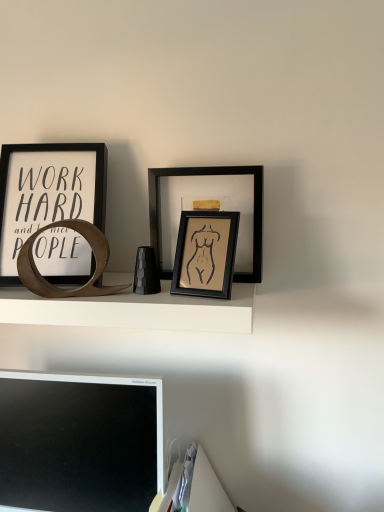
Question: Is white matte shelf at center in front of or behind matte black picture frame at left, the 3th picture frame in the right-to-left sequence, in the image?

Choices:
 (A) front
 (B) behind

Answer: (A)

Question: Considering the positions of white matte shelf at center and matte black picture frame at left, acting as the first picture frame starting from the left, in the image, is white matte shelf at center bigger or smaller than matte black picture frame at left, acting as the first picture frame starting from the left,?

Choices:
 (A) small
 (B) big

Answer: (B)

Question: Which of these objects is positioned farthest from the white matte shelf at center?

Choices:
 (A) black matte computer monitor at lower left
 (B) matte black picture frame at center, which ranks as the 3th picture frame in left-to-right order
 (C) matte black picture frame at left, the 3th picture frame in the right-to-left sequence
 (D) matte black picture frame at center, positioned as the 2th picture frame in left-to-right order

Answer: (A)

Question: Considering the real-world distances, which object is farthest from the matte black picture frame at center, positioned as the 2th picture frame in left-to-right order?

Choices:
 (A) white matte shelf at center
 (B) matte black picture frame at center, acting as the first picture frame starting from the right
 (C) matte black picture frame at left, acting as the first picture frame starting from the left
 (D) black matte computer monitor at lower left

Answer: (D)